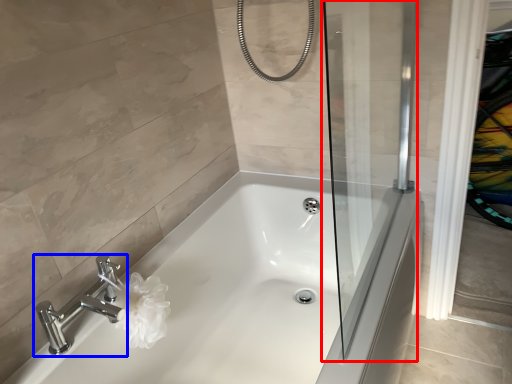
Question: Which object appears farthest to the camera in this image, screen door (highlighted by a red box) or tap (highlighted by a blue box)?

Choices:
 (A) screen door
 (B) tap

Answer: (B)